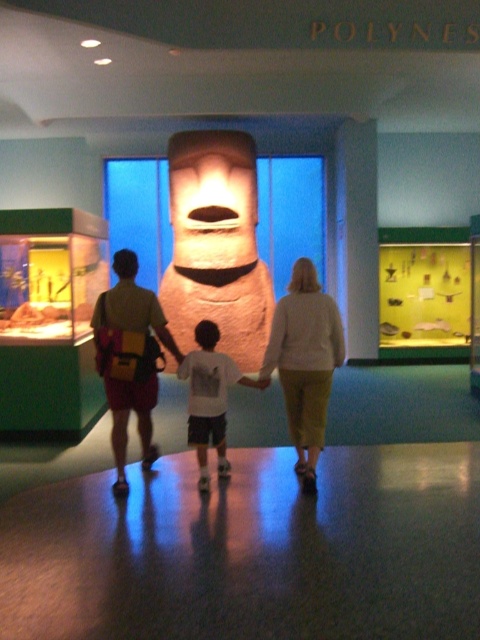
From the picture: You are a tour guide leading a group through the museum. You need to direct visitors to the matte stone statue at center and the light beige sweater at center. Which object is closer to the left side of the scene?

The matte stone statue at center is positioned to the left of the light beige sweater at center, so it is closer to the left side of the scene.

You are a museum visitor who wants to take a photo of the Moai statue without any obstruction. You notice a yellow backpack at center and a white cotton shirt at center in your camera frame. Which object is less likely to block your view of the statue?

The yellow backpack at center is thinner than the white cotton shirt at center, so it is less likely to block your view of the statue.

You are a tour guide in the Polynesian section of the museum. You need to ensure visitors maintain a minimum distance of 20 inches between themselves for safety. Two visitors are wearing a light beige sweater at center and a white cotton shirt at center. Are they violating the safety distance rule?

The light beige sweater at center and white cotton shirt at center are 18.98 inches apart from each other, which is less than the required 20 inches. Therefore, they are violating the safety distance rule.